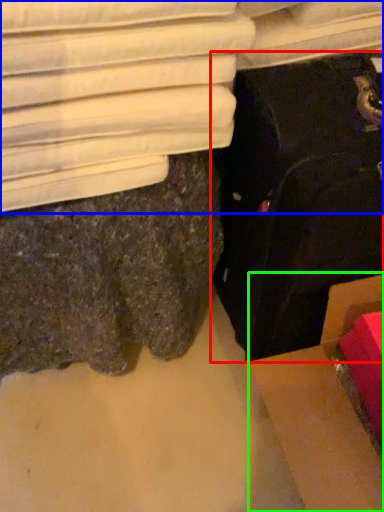
Question: Based on their relative distances, which object is nearer to suitcase (highlighted by a red box)? Choose from furniture (highlighted by a blue box) and cardboard box (highlighted by a green box).

Choices:
 (A) furniture
 (B) cardboard box

Answer: (B)